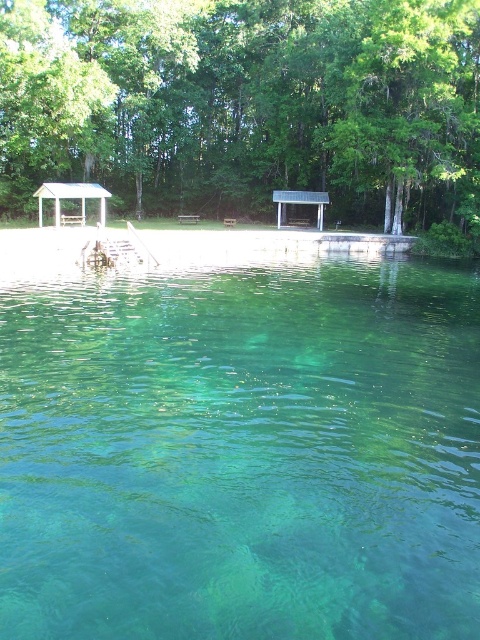
You are standing at the shoreline and want to reach the clear water at center. Which direction should you move to get there?

The clear water at center is located at point coordinates, so you should move towards the center from the shoreline to reach it.

You are standing on the sandy shore and want to take a photo of both the clear water at center and the green leafy tree at center. Which object should you place to the left in your camera frame?

The green leafy tree at center should be placed to the left in your camera frame because the clear water at center is positioned on the right side of it.

You are organizing a picnic and need to place a blanket between the wooden picnic table at center and the wooden park bench at center. The blanket you have is 3 meters long. Will it fit between them without overlapping either object?

The wooden picnic table at center and wooden park bench at center are 3.48 meters apart. Since the blanket is 3 meters long, it will fit between them with some space left over, so yes, it can be placed without overlapping either object.